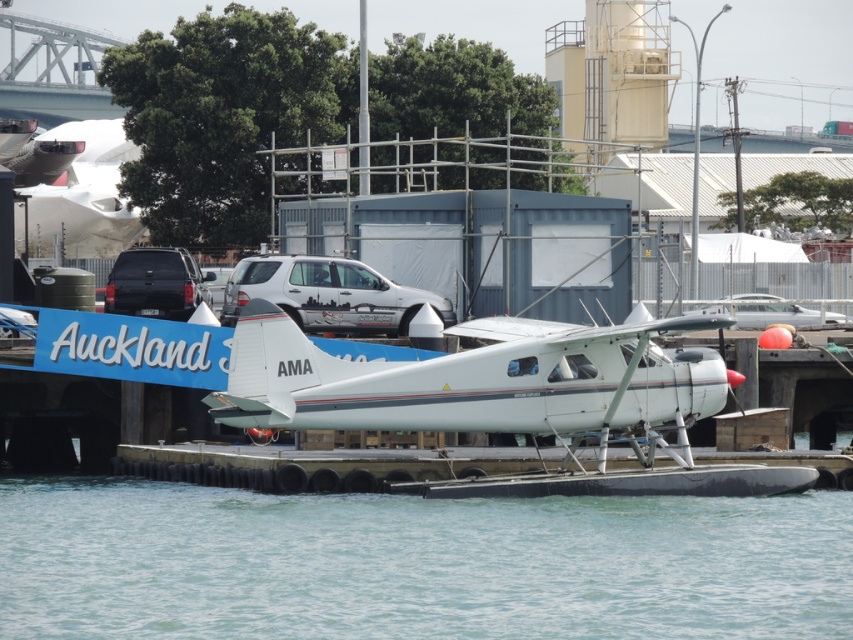
Does white matte seaplane at center have a lesser height compared to white glossy car at center?

Indeed, white matte seaplane at center has a lesser height compared to white glossy car at center.

Can you confirm if white matte seaplane at center is positioned above white glossy car at center?

No.

Locate an element on the screen. The image size is (853, 640). white matte seaplane at center is located at coordinates (473, 381).

You are a GUI agent. You are given a task and a screenshot of the screen. Output one action in this format:
    pyautogui.click(x=<x>, y=<y>)
    Task: Click on the white matte seaplane at center
    The image size is (853, 640).
    Given the screenshot: What is the action you would take?
    [x=473, y=381]

Does white glossy car at center appear on the right side of matte black suv at upper left?

Yes, white glossy car at center is to the right of matte black suv at upper left.

This screenshot has height=640, width=853. Describe the element at coordinates (328, 294) in the screenshot. I see `white glossy car at center` at that location.

The image size is (853, 640). In order to click on white glossy car at center in this screenshot , I will do `click(328, 294)`.

Which is below, white matte seaplane at center or matte black suv at upper left?

white matte seaplane at center is below.

This screenshot has width=853, height=640. What do you see at coordinates (473, 381) in the screenshot? I see `white matte seaplane at center` at bounding box center [473, 381].

You are a GUI agent. You are given a task and a screenshot of the screen. Output one action in this format:
    pyautogui.click(x=<x>, y=<y>)
    Task: Click on the white matte seaplane at center
    The width and height of the screenshot is (853, 640).
    Given the screenshot: What is the action you would take?
    pyautogui.click(x=473, y=381)